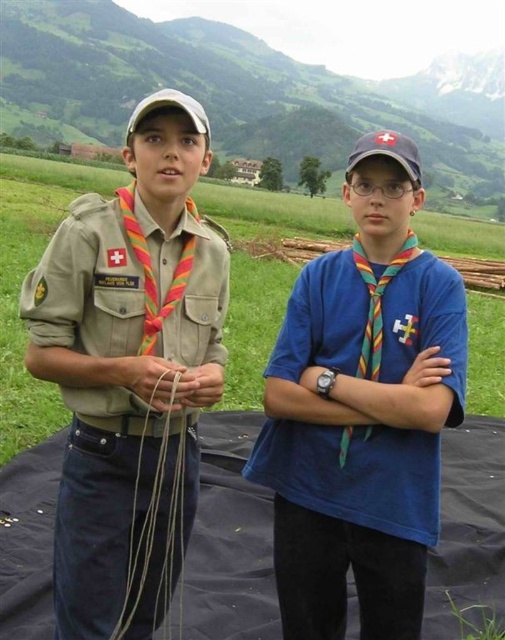
Does blue matte shirt at center lie behind natural tan string at lower left?

Yes, it is behind natural tan string at lower left.

Who is positioned more to the left, blue matte shirt at center or natural tan string at lower left?

Positioned to the left is natural tan string at lower left.

In the scene shown: Who is more distant from viewer, (398, 330) or (180, 522)?

Point (398, 330)

I want to click on blue matte shirt at center, so click(362, 410).

Which is behind, point (214, 259) or point (225, 474)?

Positioned behind is point (225, 474).

The height and width of the screenshot is (640, 505). Find the location of `tan uniform at left`. tan uniform at left is located at coordinates (130, 372).

Who is more forward, (46, 340) or (495, 420)?

Positioned in front is point (46, 340).

The image size is (505, 640). I want to click on tan uniform at left, so click(130, 372).

Is tan uniform at left to the right of natural tan string at lower left from the viewer's perspective?

No, tan uniform at left is not to the right of natural tan string at lower left.

Does tan uniform at left have a greater width compared to natural tan string at lower left?

Yes, tan uniform at left is wider than natural tan string at lower left.

I want to click on tan uniform at left, so click(x=130, y=372).

The image size is (505, 640). Identify the location of tan uniform at left. (130, 372).